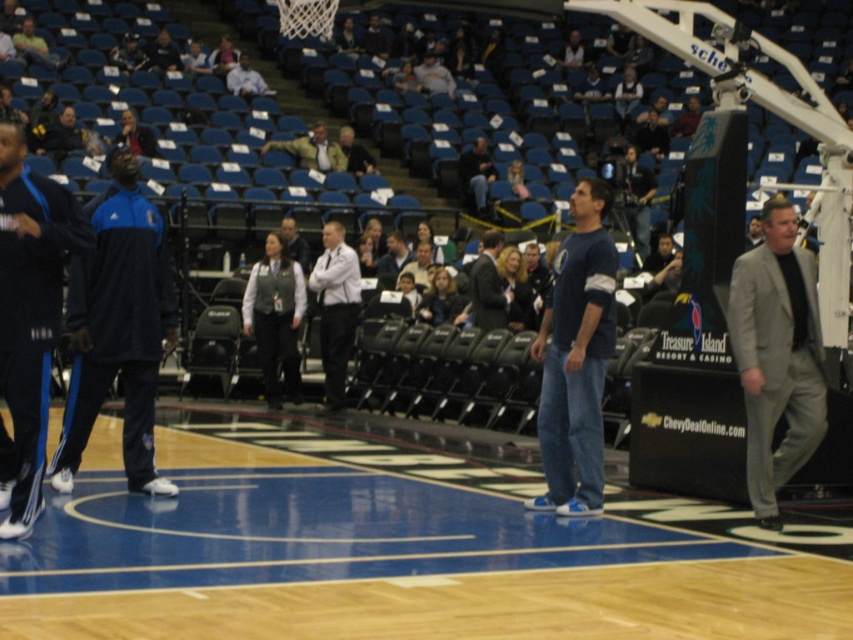
A player in a blue synthetic track suit at left and another person in casual attire at right are in the basketball arena. How far apart are they?

They are 31.32 feet apart.

You are a photographer positioned at the entrance of the basketball arena. You want to take a photo that includes both the blue synthetic track suit at left and the dark gray suit at center. Based on their positions, which object will appear closer to the camera in the final photo?

The blue synthetic track suit at left will appear closer to the camera in the final photo because it is positioned in front of the dark gray suit at center.

You are a photographer setting up for a basketball game. You need to capture a shot that includes both the light brown leather jacket at upper center and the dark blue jeans at center. Based on their positions, which object should you place on the left side of your frame to ensure both are visible?

The light brown leather jacket at upper center should be placed on the left side of your frame because it is positioned on the left side of the dark blue jeans at center, ensuring both are visible in the shot.